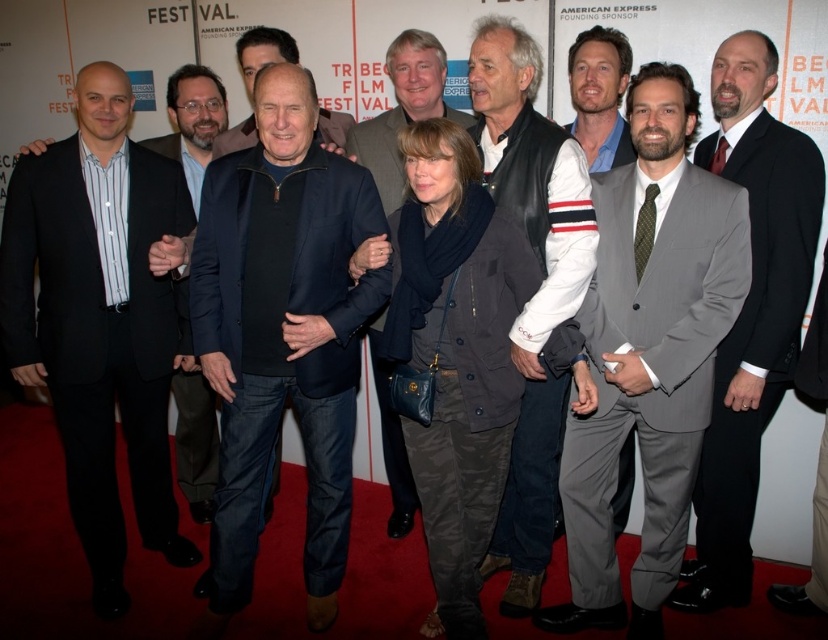
Question: Which of the following is the farthest from the observer?

Choices:
 (A) (605, 116)
 (B) (579, 147)

Answer: (A)

Question: Observing the image, what is the correct spatial positioning of leather vest at center in reference to dark blue sweater at center?

Choices:
 (A) right
 (B) left

Answer: (A)

Question: Is light blue shirt at center smaller than dark blue sweater at center?

Choices:
 (A) yes
 (B) no

Answer: (A)

Question: Is dark blue jacket at center thinner than dark blue sweater at center?

Choices:
 (A) no
 (B) yes

Answer: (A)

Question: Which object is farther from the camera taking this photo?

Choices:
 (A) dark blue sweater at center
 (B) dark gray leather jacket at center
 (C) gray suit at right
 (D) light blue shirt at center

Answer: (B)

Question: Which object appears closest to the camera in this image?

Choices:
 (A) light blue shirt at center
 (B) dark blue jacket at center
 (C) dark gray leather jacket at center

Answer: (B)